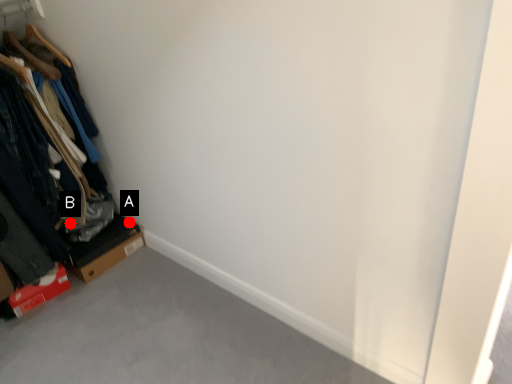
Question: Two points are circled on the image, labeled by A and B beside each circle. Which point appears closest to the camera in this image?

Choices:
 (A) A is closer
 (B) B is closer

Answer: (B)